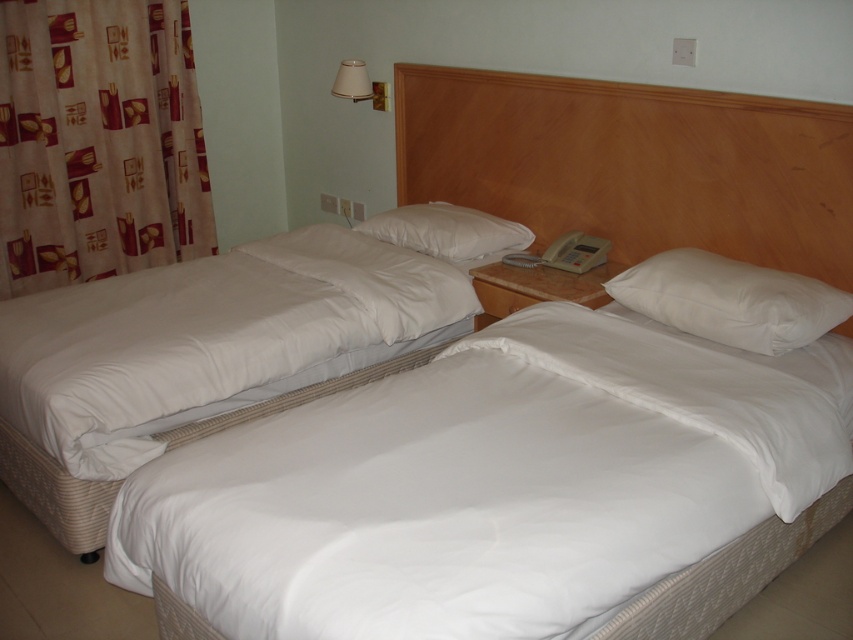
Is wooden headboard at upper center below white fabric lampshade at upper center?

Yes, wooden headboard at upper center is below white fabric lampshade at upper center.

Is point (788, 132) closer to viewer compared to point (386, 97)?

Yes, it is.

This screenshot has height=640, width=853. What are the coordinates of `wooden headboard at upper center` in the screenshot? It's located at (633, 164).

You are a GUI agent. You are given a task and a screenshot of the screen. Output one action in this format:
    pyautogui.click(x=<x>, y=<y>)
    Task: Click on the wooden headboard at upper center
    This screenshot has height=640, width=853.
    Given the screenshot: What is the action you would take?
    pyautogui.click(x=633, y=164)

Image resolution: width=853 pixels, height=640 pixels. Describe the element at coordinates (633, 164) in the screenshot. I see `wooden headboard at upper center` at that location.

You are a GUI agent. You are given a task and a screenshot of the screen. Output one action in this format:
    pyautogui.click(x=<x>, y=<y>)
    Task: Click on the wooden headboard at upper center
    
    Given the screenshot: What is the action you would take?
    pyautogui.click(x=633, y=164)

Where is `wooden headboard at upper center`? wooden headboard at upper center is located at coordinates (633, 164).

Is white quilted bed at center wider than white soft pillow at center?

Correct, the width of white quilted bed at center exceeds that of white soft pillow at center.

Does white quilted bed at center have a smaller size compared to white soft pillow at center?

No, white quilted bed at center is not smaller than white soft pillow at center.

Find the location of a particular element. This screenshot has height=640, width=853. white quilted bed at center is located at coordinates (479, 486).

The width and height of the screenshot is (853, 640). I want to click on white quilted bed at center, so (479, 486).